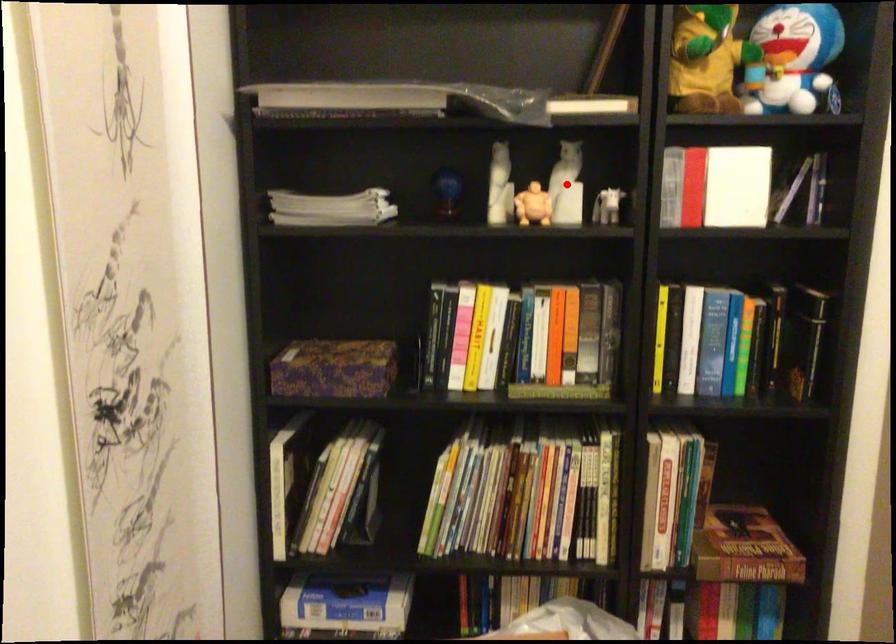
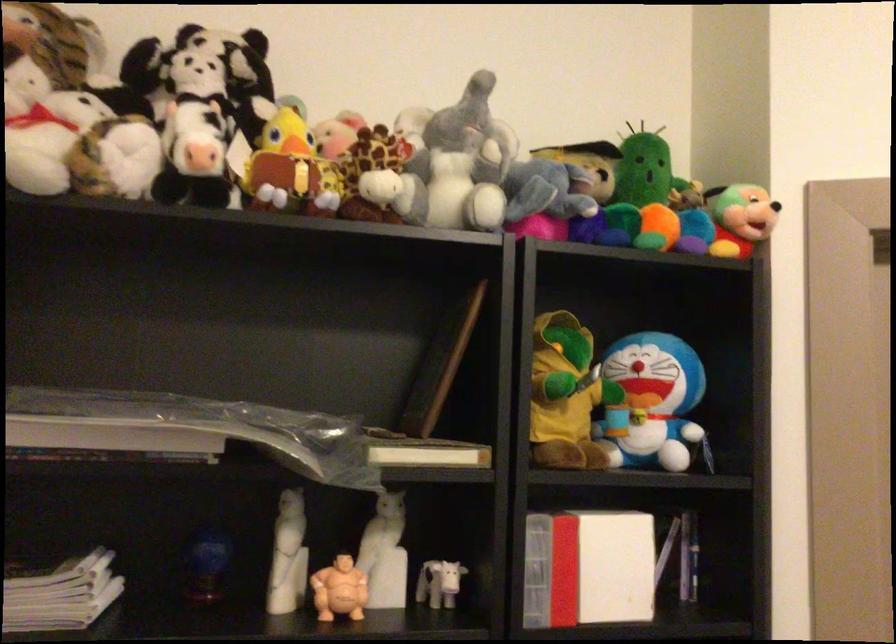
Where in the second image is the point corresponding to the highlighted location from the first image?

(384, 554)